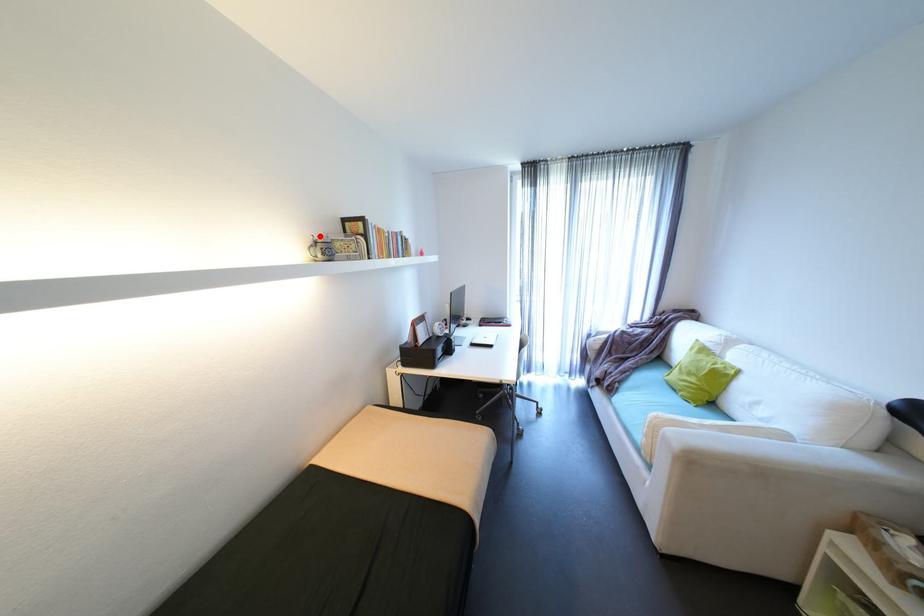
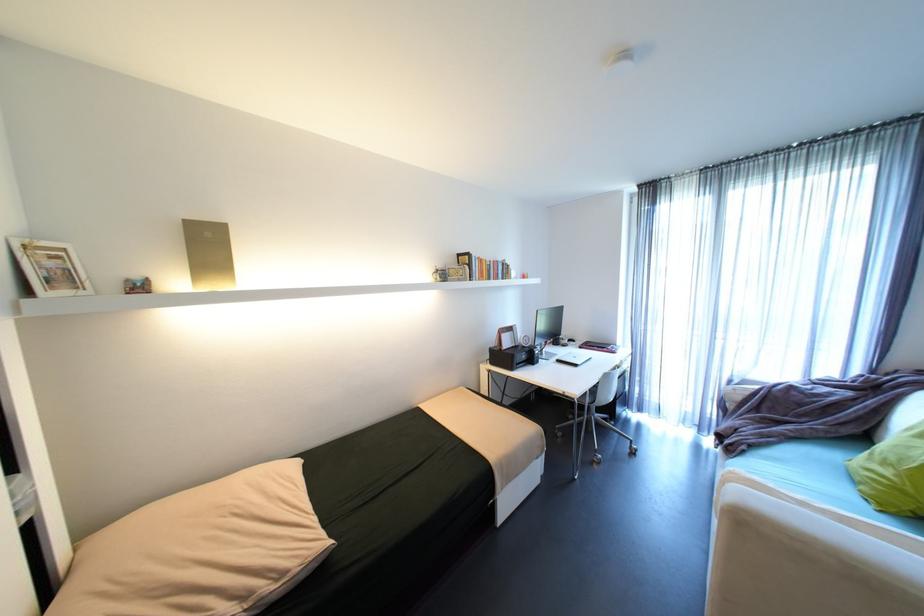
The point at the highlighted location is marked in the first image. Where is the corresponding point in the second image?

(444, 267)